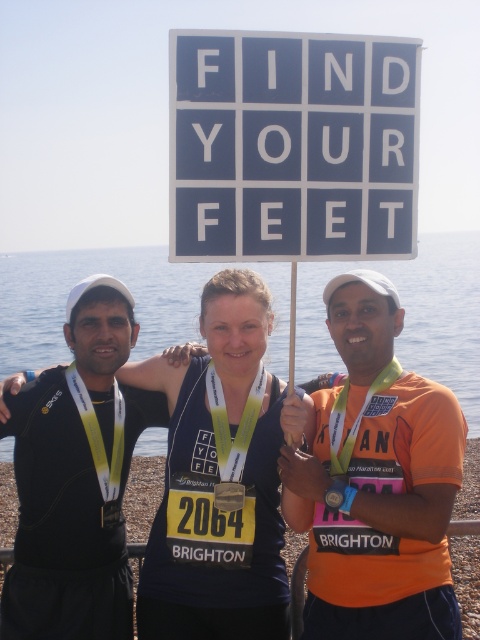
You are a photographer standing at the back of the scene. You want to take a photo that includes both the white plastic sign at upper center and the orange fabric shirt at center. What is the minimum distance you need to move backward to ensure both objects are in frame?

The white plastic sign at upper center and orange fabric shirt at center are 93.86 centimeters apart. To include both in the frame, you need to move back until your camera can capture a field of view wide enough to encompass 93.86 centimeters between them.

You are standing at the position of the person wearing a navy blue tank top with the number 2064 and the word Brighton. You want to take a photo of the two people on your left and right. Which person is closer to you, the one at point (355, 637) or the one at point (217, 506)?

The person at point (355, 637) is closer to you because point (355, 637) is in front of point (217, 506).

You are standing in the scene and want to place a small gift box exactly at the point marked as point (267, 106). If the box is 2 feet wide, will it fit without overlapping any of the three runners?

The distance of point (267, 106) from viewer is 10.76 feet. Since the box is only 2 feet wide and placed at this point, it should fit without overlapping any runners as there is sufficient space at that distance.